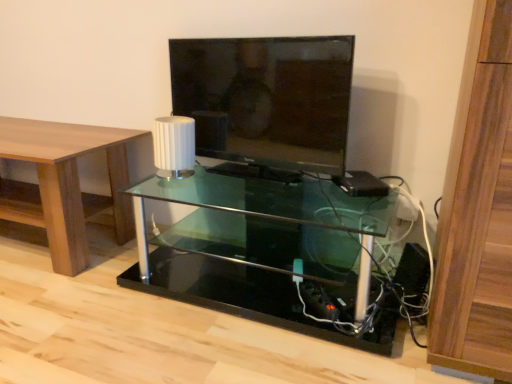
In order to face black plastic speaker at lower right, should I rotate leftwards or rightwards?

You should look right and rotate roughly 20.056 degrees.

Locate an element on the screen. The image size is (512, 384). matte black tv at center is located at coordinates (268, 98).

Locate an element on the screen. Image resolution: width=512 pixels, height=384 pixels. black plastic speaker at lower right is located at coordinates (413, 269).

Are matte black tv at center and wooden table at left located far from each other?

They are positioned close to each other.

From the image's perspective, which one is positioned lower, matte black tv at center or wooden table at left?

wooden table at left, from the image's perspective.

Which of these two, matte black tv at center or wooden table at left, is bigger?

With larger size is wooden table at left.

Find the location of a particular element. table lying behind the matte black tv at center is located at coordinates pyautogui.click(x=66, y=184).

From the image's perspective, is white matte lamp at center on transparent glass shelf at center?

Correct, white matte lamp at center appears higher than transparent glass shelf at center in the image.

In the image, is white matte lamp at center positioned in front of or behind transparent glass shelf at center?

In the image, white matte lamp at center appears behind transparent glass shelf at center.

In the scene shown: Who is smaller, white matte lamp at center or transparent glass shelf at center?

Smaller between the two is white matte lamp at center.

Could you tell me if white matte lamp at center is turned towards transparent glass shelf at center?

No, white matte lamp at center is not oriented towards transparent glass shelf at center.

I want to click on lamp below the matte black tv at center (from a real-world perspective), so click(x=174, y=146).

Is matte black tv at center inside white matte lamp at center?

No, matte black tv at center is located outside of white matte lamp at center.

From the image's perspective, would you say white matte lamp at center is shown under matte black tv at center?

Yes, from the image's perspective, white matte lamp at center is beneath matte black tv at center.

Measure the distance from white matte lamp at center to matte black tv at center.

white matte lamp at center and matte black tv at center are 10.80 inches apart.

Measure the distance from wooden table at left to white matte lamp at center.

They are 15.78 inches apart.

Is point (71, 251) positioned after point (169, 160)?

Yes, it is behind point (169, 160).

Is wooden table at left not within white matte lamp at center?

wooden table at left is positioned outside white matte lamp at center.

From the image's perspective, is black plastic speaker at lower right under wooden table at left?

Correct, black plastic speaker at lower right appears lower than wooden table at left in the image.

Where is `speaker below the wooden table at left (from the image's perspective)`? Image resolution: width=512 pixels, height=384 pixels. speaker below the wooden table at left (from the image's perspective) is located at coordinates (413, 269).

Is transparent glass shelf at center facing towards black plastic speaker at lower right?

No, transparent glass shelf at center is not oriented towards black plastic speaker at lower right.

Considering the relative sizes of transparent glass shelf at center and black plastic speaker at lower right in the image provided, is transparent glass shelf at center taller than black plastic speaker at lower right?

Correct, transparent glass shelf at center is much taller as black plastic speaker at lower right.

From the image's perspective, is transparent glass shelf at center over black plastic speaker at lower right?

Yes.

Is transparent glass shelf at center bigger than black plastic speaker at lower right?

Indeed, transparent glass shelf at center has a larger size compared to black plastic speaker at lower right.

Image resolution: width=512 pixels, height=384 pixels. Find the location of `television that appears on the left of transparent glass shelf at center`. television that appears on the left of transparent glass shelf at center is located at coordinates (268, 98).

Between matte black tv at center and transparent glass shelf at center, which one has more height?

matte black tv at center.

From the image's perspective, relative to transparent glass shelf at center, is matte black tv at center above or below?

matte black tv at center is situated higher than transparent glass shelf at center in the image.

From the picture: Considering the positions of objects matte black tv at center and transparent glass shelf at center in the image provided, who is in front, matte black tv at center or transparent glass shelf at center?

transparent glass shelf at center is more forward.

This screenshot has width=512, height=384. I want to click on television in front of the wooden table at left, so click(268, 98).

What are the coordinates of `lamp located on the left of transparent glass shelf at center` in the screenshot? It's located at (174, 146).

Which object lies further to the anchor point white matte lamp at center, wooden table at left or black plastic speaker at lower right?

black plastic speaker at lower right lies further to white matte lamp at center than the other object.

From the picture: From the image, which object appears to be nearer to wooden table at left, white matte lamp at center or black plastic speaker at lower right?

white matte lamp at center lies closer to wooden table at left than the other object.

Based on their spatial positions, is matte black tv at center or white matte lamp at center closer to black plastic speaker at lower right?

matte black tv at center is closer to black plastic speaker at lower right.

Which object lies nearer to the anchor point matte black tv at center, transparent glass shelf at center or white matte lamp at center?

white matte lamp at center.

Looking at the image, which one is located closer to transparent glass shelf at center, white matte lamp at center or wooden table at left?

The object closer to transparent glass shelf at center is white matte lamp at center.

Which object lies further to the anchor point matte black tv at center, black plastic speaker at lower right or wooden table at left?

Among the two, black plastic speaker at lower right is located further to matte black tv at center.

Consider the image. Based on their spatial positions, is transparent glass shelf at center or black plastic speaker at lower right further from wooden table at left?

black plastic speaker at lower right is further to wooden table at left.

Which object lies further to the anchor point white matte lamp at center, black plastic speaker at lower right or wooden table at left?

black plastic speaker at lower right lies further to white matte lamp at center than the other object.

Identify the location of shelf between white matte lamp at center and black plastic speaker at lower right from left to right. The height and width of the screenshot is (384, 512). (264, 253).

The image size is (512, 384). Identify the location of shelf between matte black tv at center and black plastic speaker at lower right vertically. 264,253.

The width and height of the screenshot is (512, 384). Find the location of `lamp between wooden table at left and transparent glass shelf at center in the horizontal direction`. lamp between wooden table at left and transparent glass shelf at center in the horizontal direction is located at coordinates (174, 146).

Find the location of a particular element. lamp between wooden table at left and matte black tv at center in the horizontal direction is located at coordinates (174, 146).